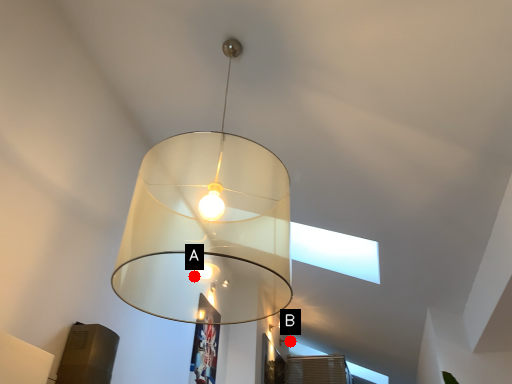
Question: Two points are circled on the image, labeled by A and B beside each circle. Among these points, which one is farthest from the camera?

Choices:
 (A) A is further
 (B) B is further

Answer: (B)